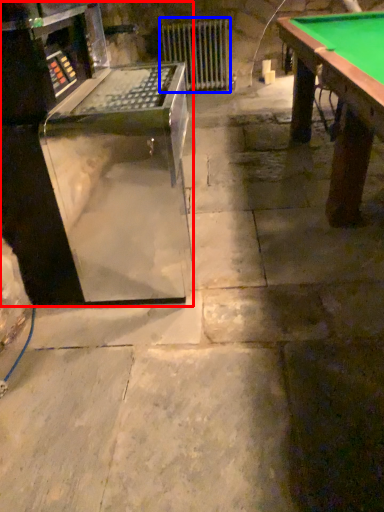
Question: Which object is closer to the camera taking this photo, equipment (highlighted by a red box) or radiator (highlighted by a blue box)?

Choices:
 (A) equipment
 (B) radiator

Answer: (A)